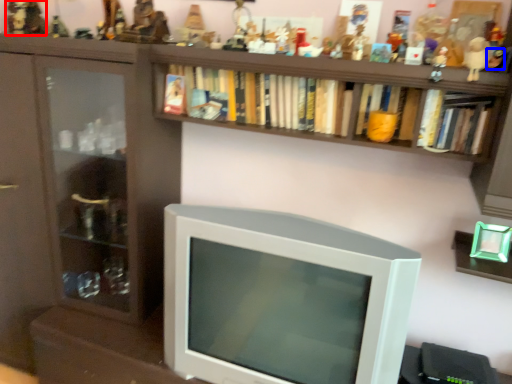
Question: Which of the following is the farthest to the observer, toy (highlighted by a red box) or toy (highlighted by a blue box)?

Choices:
 (A) toy
 (B) toy

Answer: (A)